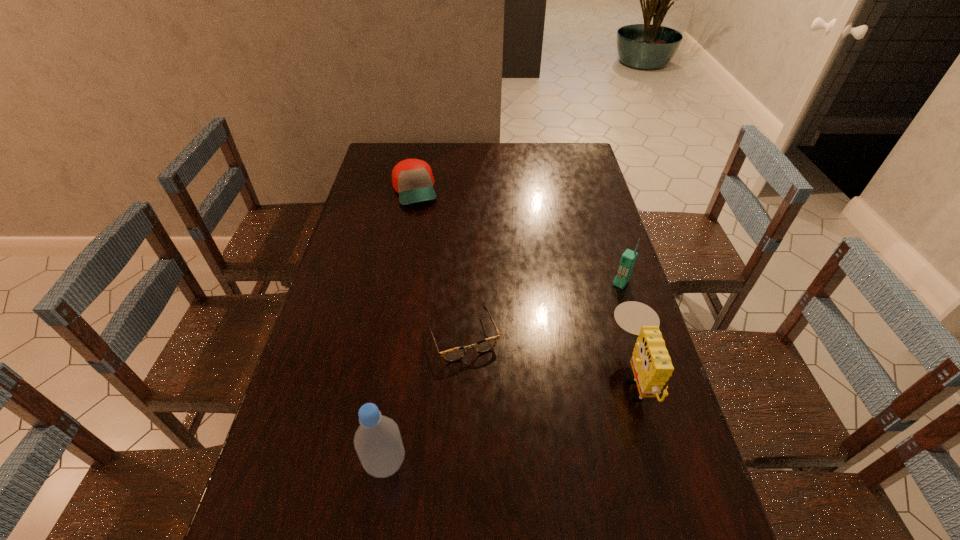
At what (x,y) coordinates should I click in order to perform the action: click on vacant space that satisfies the following two spatial constraints: 1. on the back side of the tallest object; 2. on the right side of the shortest object. Please return your answer as a coordinate pair (x, y). The image size is (960, 540). Looking at the image, I should click on (404, 337).

This screenshot has height=540, width=960. I want to click on free space in the image that satisfies the following two spatial constraints: 1. on the back side of the sponge; 2. on the front-facing side of the tallest object, so click(398, 376).

Image resolution: width=960 pixels, height=540 pixels. I want to click on vacant space that satisfies the following two spatial constraints: 1. on the front side of the baseball cap; 2. on the left side of the spectacles, so click(388, 337).

Where is `free space in the image that satisfies the following two spatial constraints: 1. on the front side of the sponge; 2. on the front-facing side of the baseball cap`? The height and width of the screenshot is (540, 960). free space in the image that satisfies the following two spatial constraints: 1. on the front side of the sponge; 2. on the front-facing side of the baseball cap is located at coordinates (381, 376).